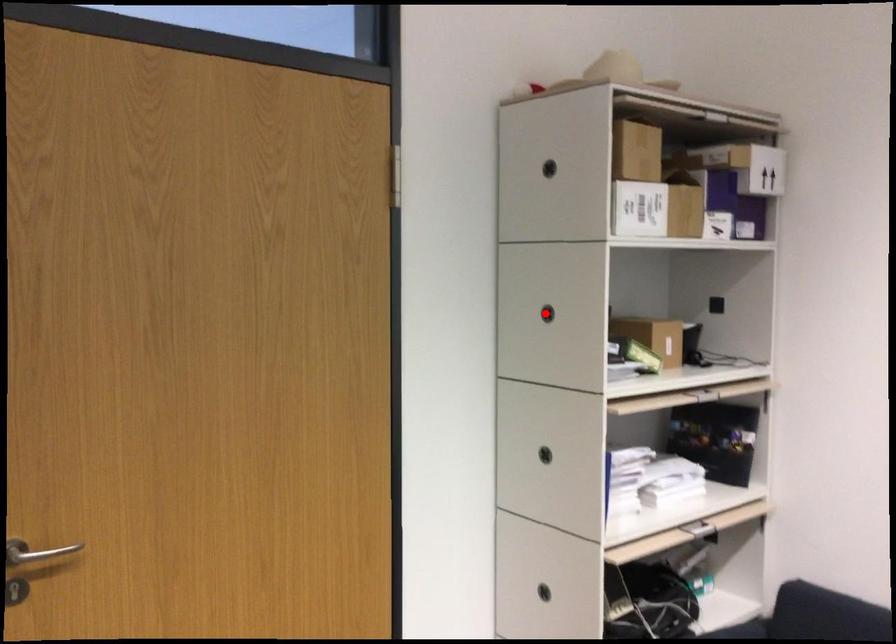
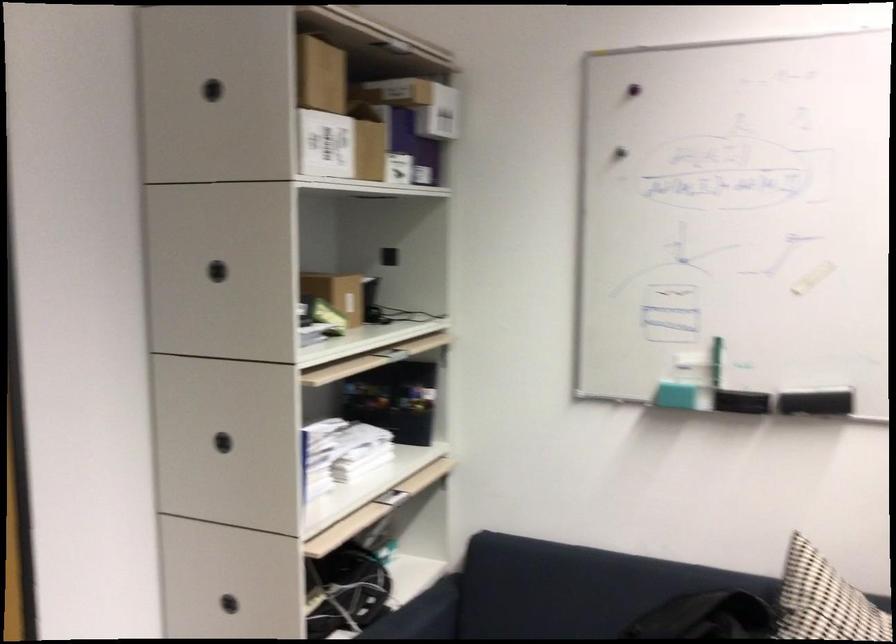
Question: I am providing you with two images of the same scene from different viewpoints. A red point is marked on the first image. Is the red point's position out of view in image 2?

Choices:
 (A) Yes
 (B) No

Answer: (B)